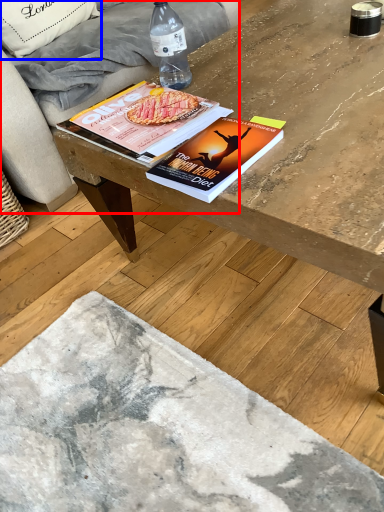
Question: Which of the following is the farthest to the observer, studio couch (highlighted by a red box) or throw pillow (highlighted by a blue box)?

Choices:
 (A) studio couch
 (B) throw pillow

Answer: (B)